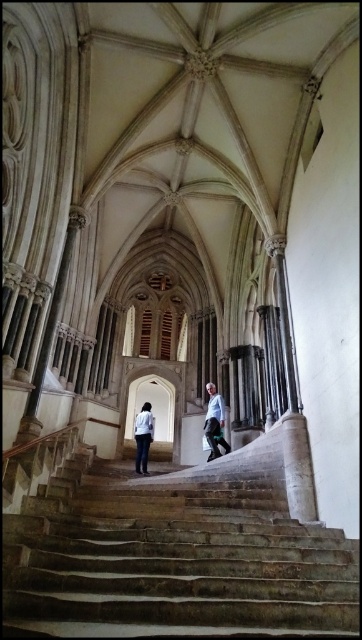
Question: Among these points, which one is farthest from the camera?

Choices:
 (A) [216, 563]
 (B) [144, 419]

Answer: (B)

Question: Is stone stairs at center below light blue shirt at center?

Choices:
 (A) yes
 (B) no

Answer: (B)

Question: Which object appears farthest from the camera in this image?

Choices:
 (A) light blue shirt at center
 (B) green fabric pants at center

Answer: (A)

Question: Which point appears closest to the camera in this image?

Choices:
 (A) (222, 426)
 (B) (219, 576)

Answer: (B)

Question: Does stone stairs at center lie in front of light blue shirt at center?

Choices:
 (A) no
 (B) yes

Answer: (B)

Question: Does stone stairs at center appear on the right side of green fabric pants at center?

Choices:
 (A) yes
 (B) no

Answer: (B)